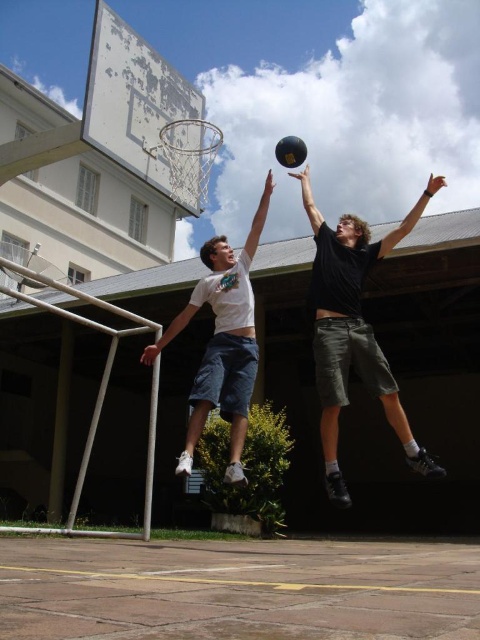
Which is more to the right, black matte basketball at center or white matte shorts at center?

From the viewer's perspective, black matte basketball at center appears more on the right side.

Is point (431, 461) behind point (239, 259)?

No, it is in front of (239, 259).

Locate an element on the screen. This screenshot has width=480, height=640. black matte basketball at center is located at coordinates (352, 328).

The height and width of the screenshot is (640, 480). What do you see at coordinates (223, 340) in the screenshot?
I see `white matte shorts at center` at bounding box center [223, 340].

Who is shorter, white matte shorts at center or silver metallic basketball hoop at upper center?

With less height is silver metallic basketball hoop at upper center.

Is point (240, 358) closer to viewer compared to point (190, 150)?

Yes, it is.

At what (x,y) coordinates should I click in order to perform the action: click on white matte shorts at center. Please return your answer as a coordinate pair (x, y). Looking at the image, I should click on (223, 340).

Who is taller, black matte basketball at center or silver metallic basketball hoop at upper center?

black matte basketball at center is taller.

Based on the photo, does black matte basketball at center have a smaller size compared to silver metallic basketball hoop at upper center?

No.

You are a GUI agent. You are given a task and a screenshot of the screen. Output one action in this format:
    pyautogui.click(x=<x>, y=<y>)
    Task: Click on the black matte basketball at center
    The width and height of the screenshot is (480, 640).
    Given the screenshot: What is the action you would take?
    pyautogui.click(x=352, y=328)